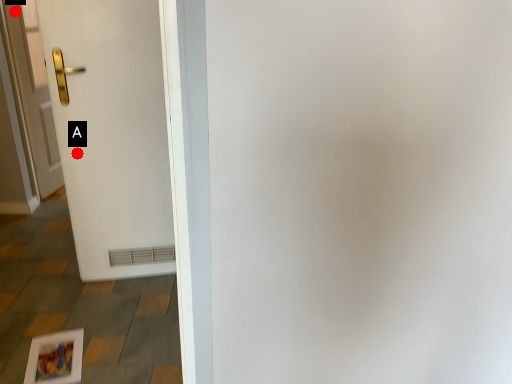
Question: Two points are circled on the image, labeled by A and B beside each circle. Which of the following is the farthest from the observer?

Choices:
 (A) A is further
 (B) B is further

Answer: (B)